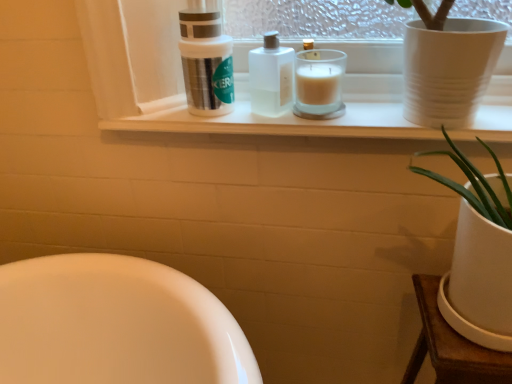
This screenshot has height=384, width=512. I want to click on vacant space situated on the left part of clear plastic bottle at center, so click(196, 119).